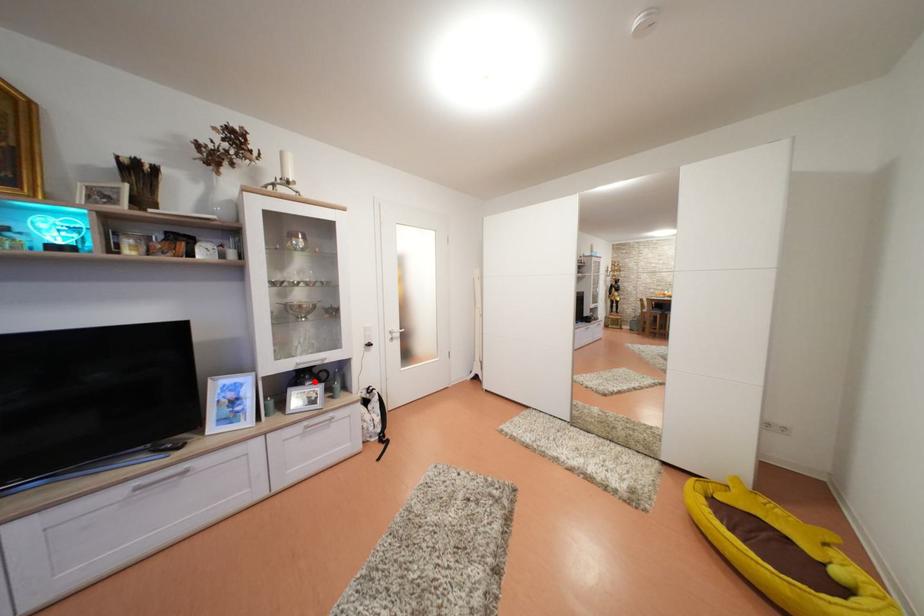
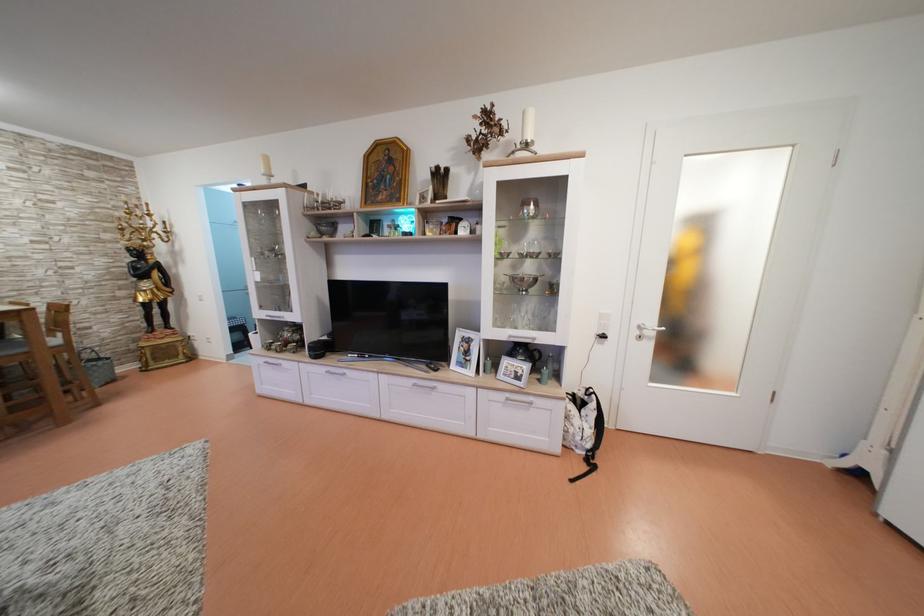
Locate, in the second image, the point that corresponds to the highlighted location in the first image.

(528, 357)